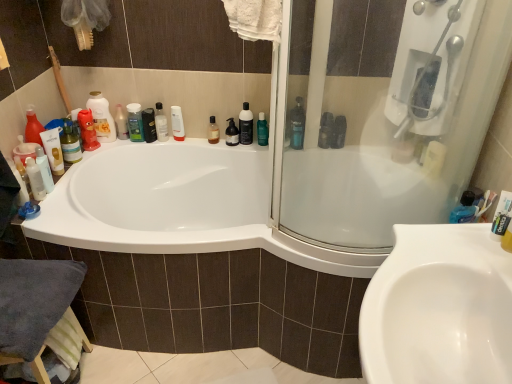
Find the location of `vacant space to the left of white matte toothpaste at right`. vacant space to the left of white matte toothpaste at right is located at coordinates (457, 248).